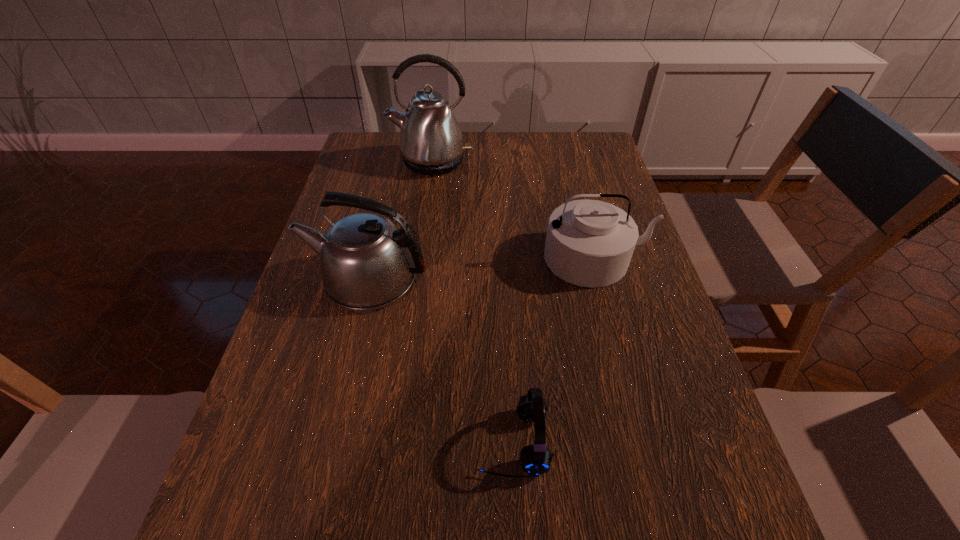
Identify the location of free space located 0.080m on the ear cushions of the second object from right to left. This screenshot has width=960, height=540. (432, 442).

Locate an element on the screen. The height and width of the screenshot is (540, 960). vacant space situated on the ear cushions of the second object from right to left is located at coordinates (427, 442).

This screenshot has height=540, width=960. Identify the location of object at the far edge. (431, 143).

This screenshot has width=960, height=540. Find the location of `object that is at the right edge`. object that is at the right edge is located at coordinates (589, 243).

Where is `object that is at the far left corner`? object that is at the far left corner is located at coordinates (431, 143).

You are a GUI agent. You are given a task and a screenshot of the screen. Output one action in this format:
    pyautogui.click(x=<x>, y=<y>)
    Task: Click on the free spot at the far edge of the desktop
    The height and width of the screenshot is (540, 960).
    Given the screenshot: What is the action you would take?
    pyautogui.click(x=541, y=164)

The image size is (960, 540). I want to click on free space at the left edge of the desktop, so click(x=331, y=425).

The image size is (960, 540). In order to click on free space at the right edge of the desktop in this screenshot , I will do `click(715, 539)`.

At what (x,y) coordinates should I click in order to perform the action: click on vacant space at the far left corner of the desktop. Please return your answer as a coordinate pair (x, y). This screenshot has height=540, width=960. Looking at the image, I should click on (390, 137).

Locate an element on the screen. empty location between the second shortest kettle and the rightmost kettle is located at coordinates (482, 268).